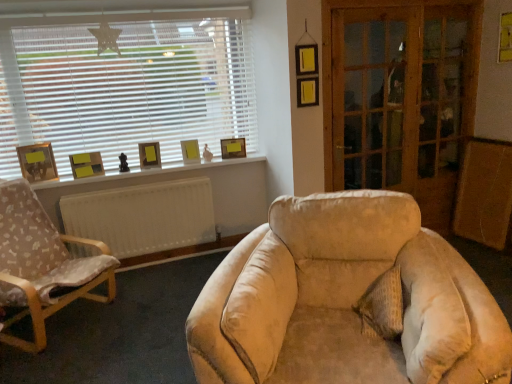
Question: Relative to yellow matte picture frame at upper center, which is counted as the first picture frame, starting from the right, is wooden glass screen door at right, which is counted as the second screen door, starting from the right, in front or behind?

Choices:
 (A) front
 (B) behind

Answer: (A)

Question: From a real-world perspective, is wooden glass screen door at right, which appears as the 1th screen door when viewed from the left, physically located above or below yellow matte picture frame at upper center, which is counted as the first picture frame, starting from the right?

Choices:
 (A) above
 (B) below

Answer: (A)

Question: Which object is the farthest from the matte yellow picture frame at center, which ranks as the second picture frame in right-to-left order?

Choices:
 (A) matte yellow picture frame at upper left, which ranks as the second picture frame in left-to-right order
 (B) wooden screen door at right, acting as the second screen door starting from the left
 (C) matte yellow picture frame at window, which ranks as the 3th picture frame in right-to-left order
 (D) yellow paper at upper right
 (E) wooden chair with fabric cushion at left

Answer: (D)

Question: Considering the real-world distances, which object is closest to the matte yellow picture frame at window, the 3th picture frame when ordered from left to right?

Choices:
 (A) textured beige pillow at center
 (B) matte yellow picture frame at upper left, which ranks as the second picture frame in left-to-right order
 (C) matte yellow picture frame at center, which is the 4th picture frame in left-to-right order
 (D) wooden chair with fabric cushion at left
 (E) wooden glass screen door at right, which is counted as the second screen door, starting from the right

Answer: (C)